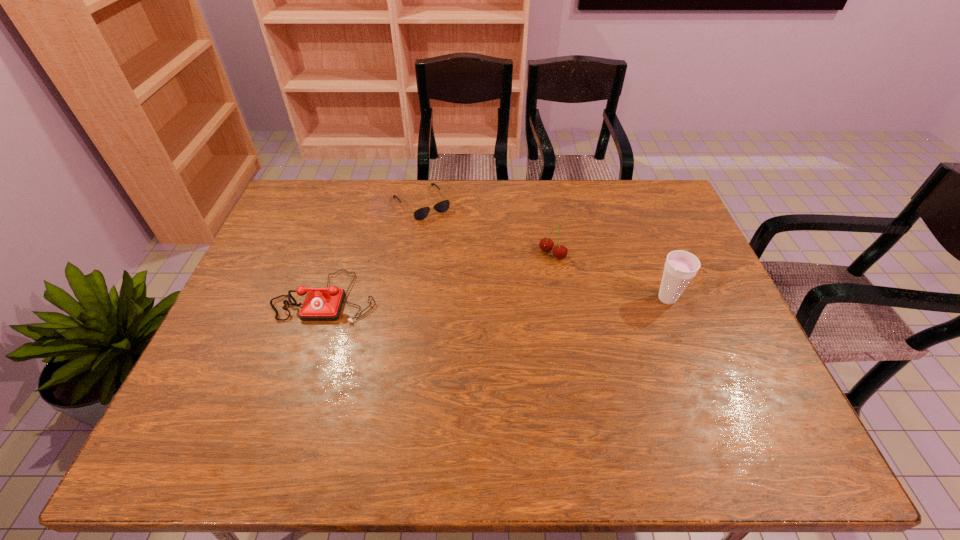
You are a GUI agent. You are given a task and a screenshot of the screen. Output one action in this format:
    pyautogui.click(x=<x>, y=<y>)
    Task: Click on the telephone
    
    Given the screenshot: What is the action you would take?
    pyautogui.click(x=321, y=304)

Locate an element on the screen. The image size is (960, 540). cup is located at coordinates (680, 267).

At what (x,y) coordinates should I click in order to perform the action: click on the tallest object. Please return your answer as a coordinate pair (x, y). Looking at the image, I should click on 680,267.

You are a GUI agent. You are given a task and a screenshot of the screen. Output one action in this format:
    pyautogui.click(x=<x>, y=<y>)
    Task: Click on the sunglasses
    Image resolution: width=960 pixels, height=540 pixels.
    Given the screenshot: What is the action you would take?
    pyautogui.click(x=420, y=214)

Identify the location of the farthest object. (420, 214).

At what (x,y) coordinates should I click in order to perform the action: click on the second farthest object. Please return your answer as a coordinate pair (x, y). The image size is (960, 540). Looking at the image, I should click on (546, 244).

This screenshot has width=960, height=540. I want to click on the second tallest object, so click(546, 244).

Find the location of a particular element. The height and width of the screenshot is (540, 960). vacant space situated 0.090m on the dial of the telephone is located at coordinates click(x=308, y=354).

Image resolution: width=960 pixels, height=540 pixels. Identify the location of vacant space located on the back of the tallest object. (636, 219).

In order to click on vacant region located on the front-facing side of the shortest object in this screenshot , I will do `click(483, 278)`.